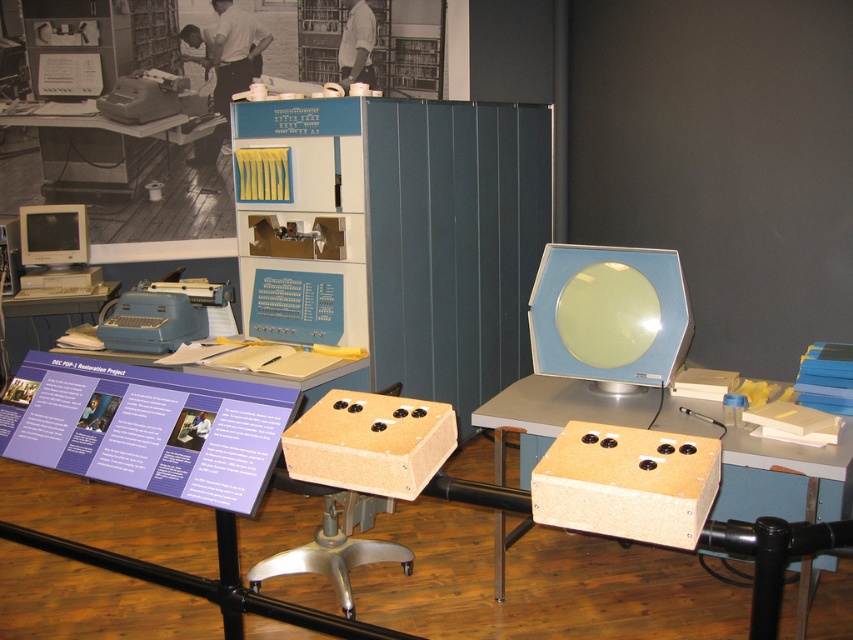
In the museum exhibit, there is a matte white monitor at left and a matte gray typewriter at upper left. Which object takes up more space in the display?

The matte white monitor at left is bigger than the matte gray typewriter at upper left, so it takes up more space in the display.